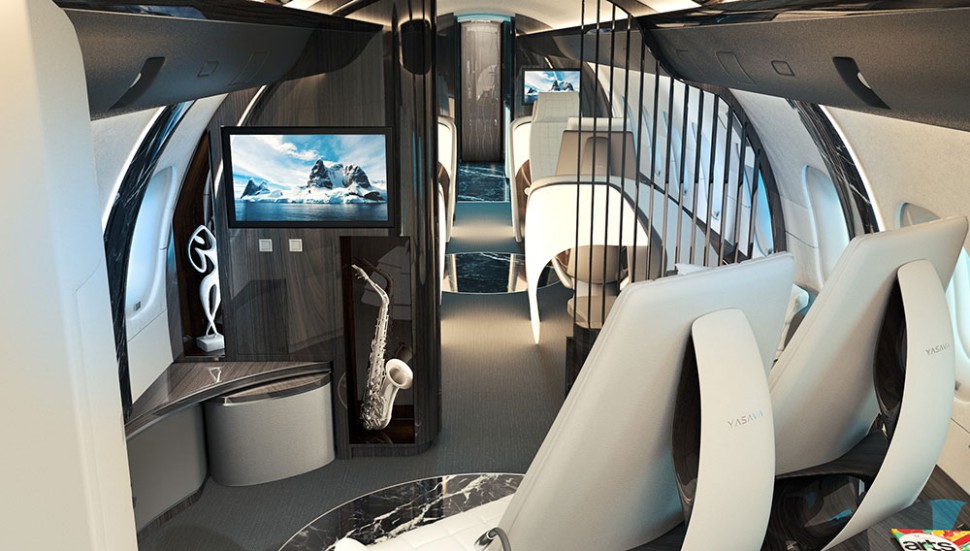
The image size is (970, 551). In order to click on grey carpet in this screenshot , I will do `click(506, 418)`.